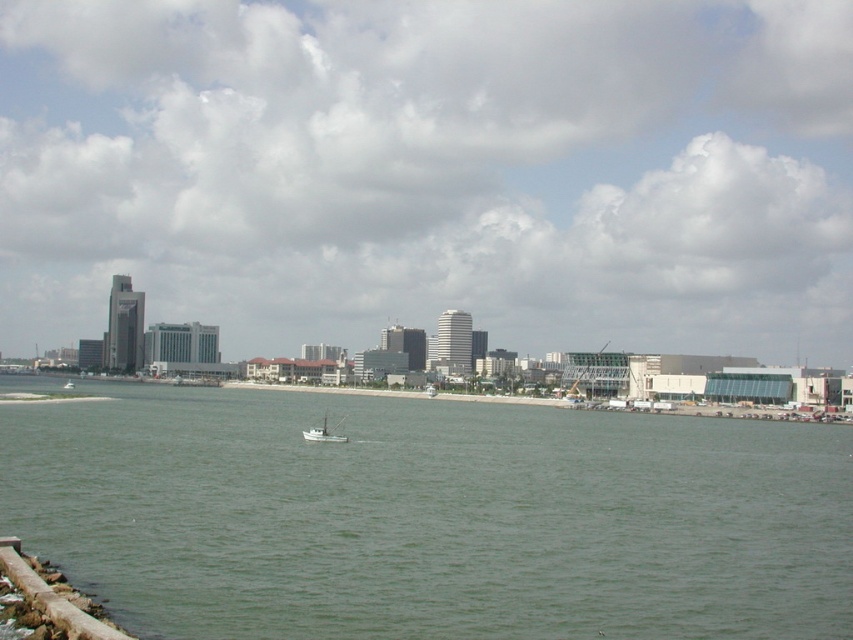
You are a photographer planning to capture the waterfront cityscape. You notice the transparent glass skyscrapers at center and the white matte boat at center in your viewfinder. Based on their sizes, which object would appear wider in the photo?

The transparent glass skyscrapers at center would appear wider in the photo since their width is larger than the white matte boat at center according to the description.

Based on the photo, you are a tourist standing on the sandy shoreline in the waterfront city. You see the transparent glass skyscrapers at center and the green water at lower left. Which object is taller?

The transparent glass skyscrapers at center are taller than the green water at lower left.

Based on the photo, you are a drone operator trying to capture a photo of the transparent glass skyscrapers at center. Your drone is currently hovering at point coordinates of (432, 172). Is the transparent glass skyscrapers at center in your current view?

The transparent glass skyscrapers at center are located exactly at the point coordinates (432, 172), so yes, the drone is hovering directly above them and they are in the current view.